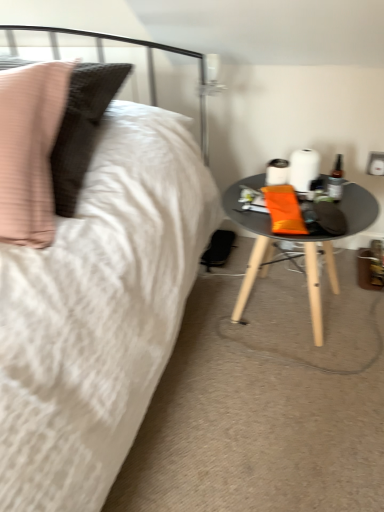
Question: Is matte black table at lower right not inside translucent glass bottle at right?

Choices:
 (A) yes
 (B) no

Answer: (A)

Question: From a real-world perspective, is matte black table at lower right on top of translucent glass bottle at right?

Choices:
 (A) no
 (B) yes

Answer: (A)

Question: Does matte black table at lower right have a lesser height compared to translucent glass bottle at right?

Choices:
 (A) no
 (B) yes

Answer: (A)

Question: Is matte black table at lower right facing towards translucent glass bottle at right?

Choices:
 (A) yes
 (B) no

Answer: (B)

Question: Does matte black table at lower right have a greater height compared to translucent glass bottle at right?

Choices:
 (A) yes
 (B) no

Answer: (A)

Question: Is translucent glass bottle at right wider or thinner than matte black table at lower right?

Choices:
 (A) thin
 (B) wide

Answer: (A)

Question: From the image's perspective, is translucent glass bottle at right located above or below matte black table at lower right?

Choices:
 (A) below
 (B) above

Answer: (B)

Question: Considering their positions, is translucent glass bottle at right located in front of or behind matte black table at lower right?

Choices:
 (A) front
 (B) behind

Answer: (B)

Question: Is point (339, 154) closer or farther from the camera than point (279, 233)?

Choices:
 (A) closer
 (B) farther

Answer: (B)

Question: Considering the positions of matte black table at lower right and white glossy electric outlet at upper right in the image, is matte black table at lower right bigger or smaller than white glossy electric outlet at upper right?

Choices:
 (A) big
 (B) small

Answer: (A)

Question: Is matte black table at lower right wider or thinner than white glossy electric outlet at upper right?

Choices:
 (A) thin
 (B) wide

Answer: (B)

Question: In terms of height, does matte black table at lower right look taller or shorter compared to white glossy electric outlet at upper right?

Choices:
 (A) tall
 (B) short

Answer: (A)

Question: Considering their positions, is matte black table at lower right located in front of or behind white glossy electric outlet at upper right?

Choices:
 (A) front
 (B) behind

Answer: (A)

Question: Considering the positions of white glossy electric outlet at upper right and translucent glass bottle at right in the image, is white glossy electric outlet at upper right bigger or smaller than translucent glass bottle at right?

Choices:
 (A) small
 (B) big

Answer: (A)

Question: Considering the positions of white glossy electric outlet at upper right and translucent glass bottle at right in the image, is white glossy electric outlet at upper right taller or shorter than translucent glass bottle at right?

Choices:
 (A) tall
 (B) short

Answer: (B)